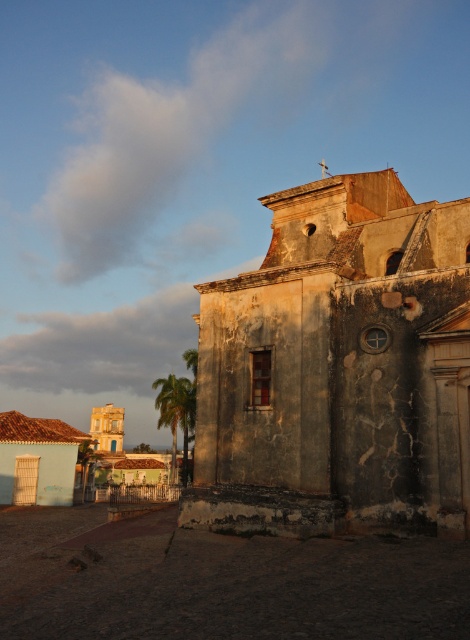
Looking at this image, you are a tourist standing at point (x=337, y=369) in the image. What is the closest object to you?

The closest object to you is the cracked stone church at center located at point (x=337, y=369).

You are standing at the entrance of the historic building and want to locate the cracked stone church at center. According to the coordinates provided, where should you look relative to your position?

The cracked stone church at center is located at coordinates point (x=337, y=369), which means it is positioned slightly to the right and lower center of your field of view.